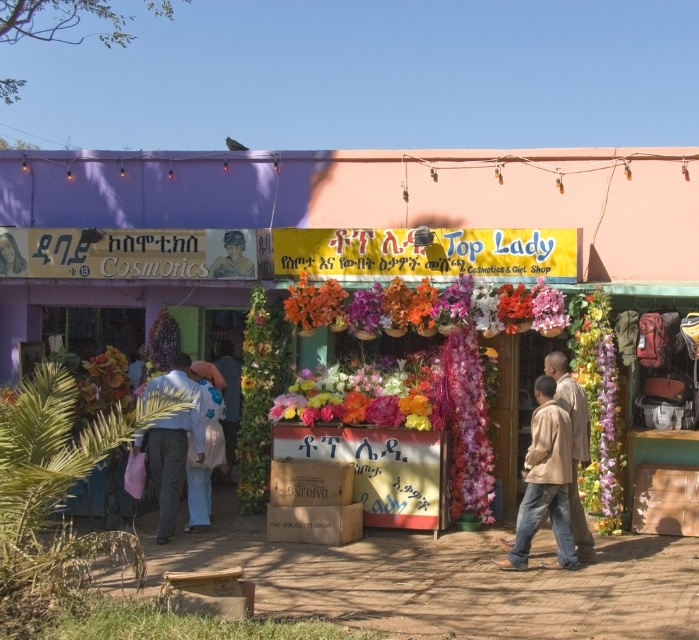
You are a customer standing in front of the store and see the brown cotton jacket at lower right and the floral fabric bouquet at center. Which object is taller?

The brown cotton jacket at lower right is taller than the floral fabric bouquet at center.

You are a customer entering the store and see the brown cotton jacket at lower right and the blue fabric shirt at center. Which item is positioned lower in the store?

The brown cotton jacket at lower right is positioned lower than the blue fabric shirt at center.